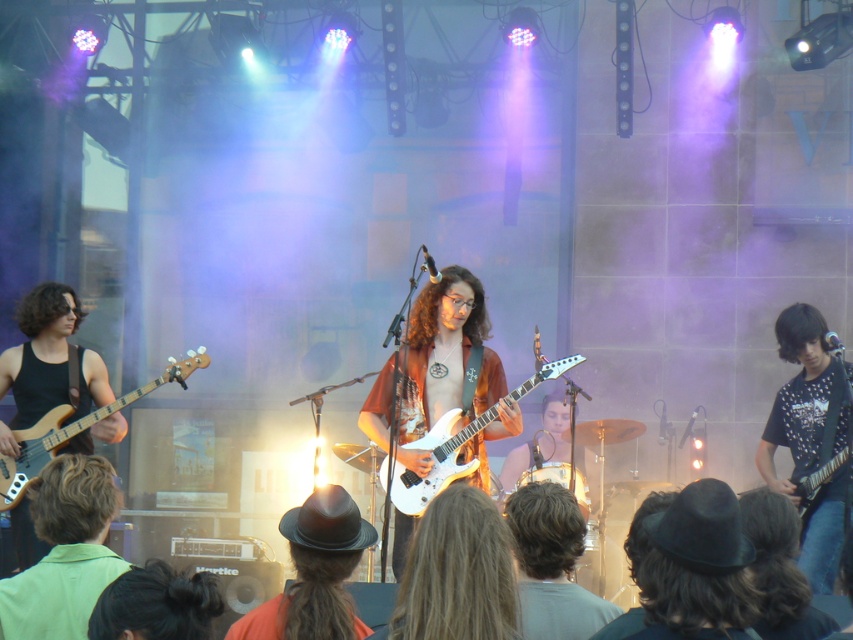
Question: Considering the real-world distances, which object is farthest from the long brown hair at center?

Choices:
 (A) black felt hat at lower center
 (B) blonde hair at center
 (C) white glossy electric guitar at center

Answer: (C)

Question: Can you confirm if green fabric shirt at lower left is bigger than shiny black electric guitar at right?

Choices:
 (A) no
 (B) yes

Answer: (B)

Question: Which point appears closest to the camera in this image?

Choices:
 (A) (281, 608)
 (B) (534, 532)

Answer: (A)

Question: Can you confirm if black felt hat at lower center is positioned above matte black bass at left?

Choices:
 (A) yes
 (B) no

Answer: (B)

Question: Which object appears closest to the camera in this image?

Choices:
 (A) black glossy electric guitar at right
 (B) shiny black electric guitar at right
 (C) black felt hat at lower center

Answer: (C)

Question: Can you confirm if black felt hat at center is wider than white glossy electric guitar at center?

Choices:
 (A) no
 (B) yes

Answer: (A)